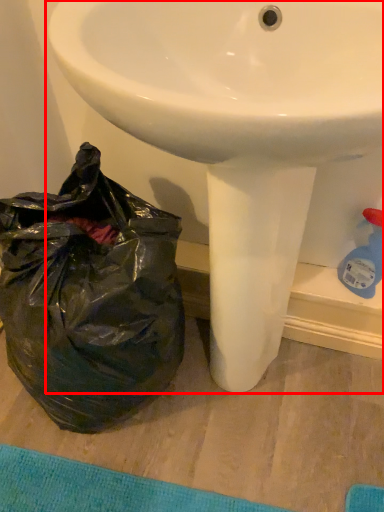
Question: From the image's perspective, considering the relative positions of sink (annotated by the red box) and plastic bag in the image provided, where is sink (annotated by the red box) located with respect to the staircase?

Choices:
 (A) below
 (B) above

Answer: (B)